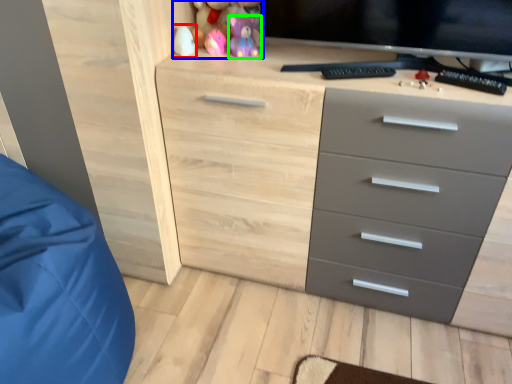
Question: Which object is positioned closest to toy (highlighted by a red box)? Select from toy (highlighted by a blue box) and toy (highlighted by a green box).

Choices:
 (A) toy
 (B) toy

Answer: (A)